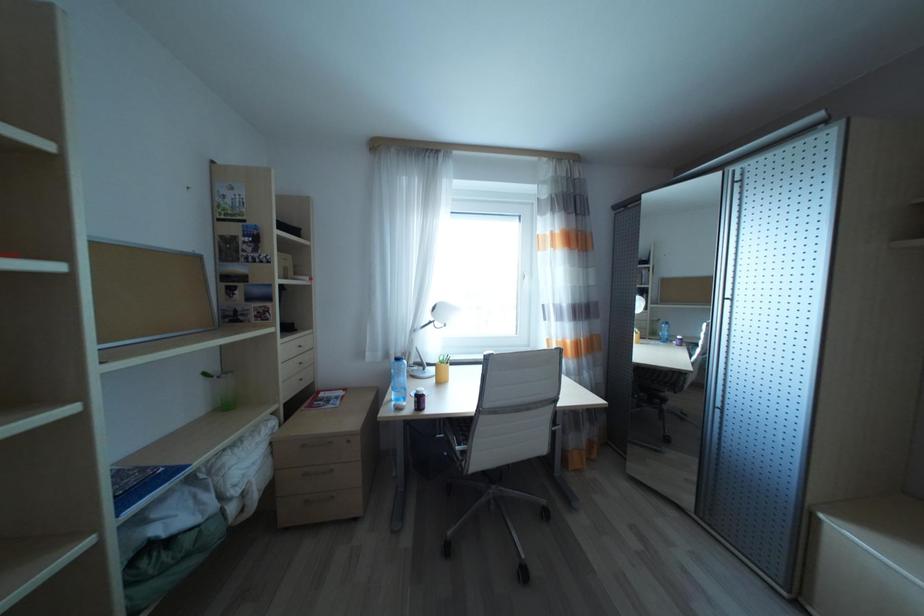
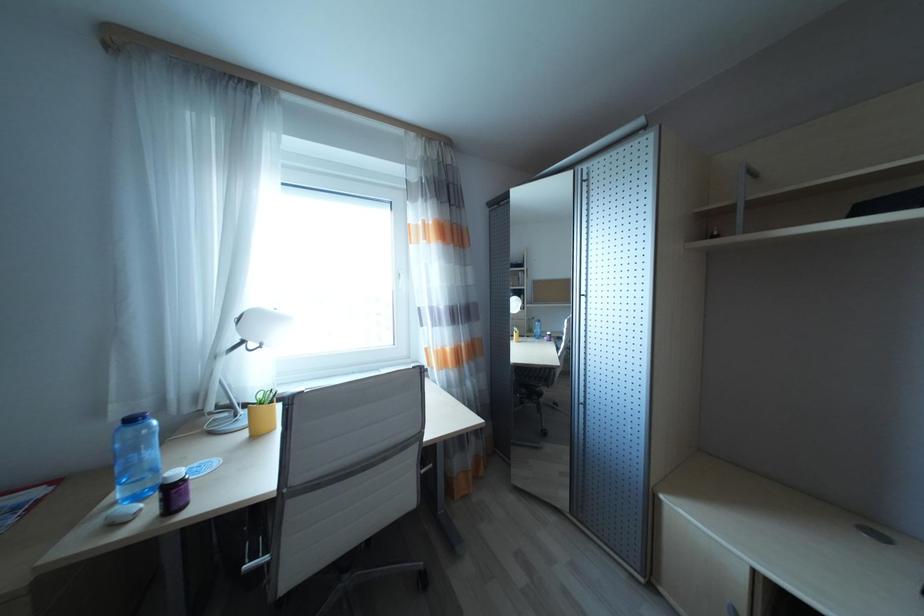
Question: Based on the continuous images, in which direction is the camera rotating? Reply with the corresponding letter.

Choices:
 (A) Left
 (B) Right
 (C) Up
 (D) Down

Answer: (B)